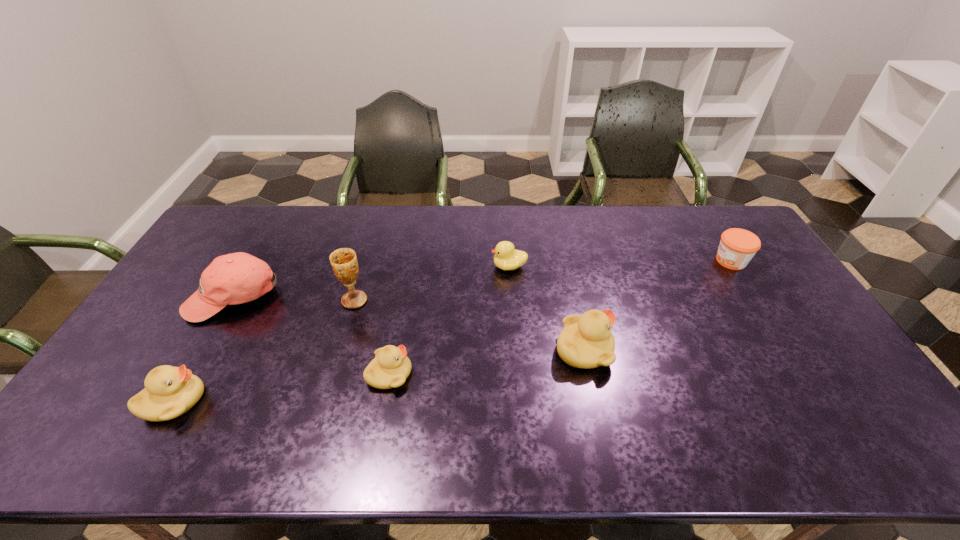
Where is `vacant point located between the jam and the third duckling from left to right`? This screenshot has height=540, width=960. vacant point located between the jam and the third duckling from left to right is located at coordinates (620, 264).

Identify which object is located as the sixth nearest to the leftmost duckling. Please provide its 2D coordinates. Your answer should be formatted as a tuple, i.e. [(x, y)], where the tuple contains the x and y coordinates of a point satisfying the conditions above.

[(737, 247)]

Locate an element on the screen. The image size is (960, 540). object that ranks as the fifth closest to the fourth tallest object is located at coordinates (586, 341).

Identify which duckling is the second closest to the third shortest duckling. Please provide its 2D coordinates. Your answer should be formatted as a tuple, i.e. [(x, y)], where the tuple contains the x and y coordinates of a point satisfying the conditions above.

[(506, 257)]

Where is `duckling that is the second closest to the third shortest duckling`? duckling that is the second closest to the third shortest duckling is located at coordinates (506, 257).

I want to click on vacant space that satisfies the following two spatial constraints: 1. on the beak of the fifth object from left to right; 2. on the front side of the baseball cap, so click(511, 296).